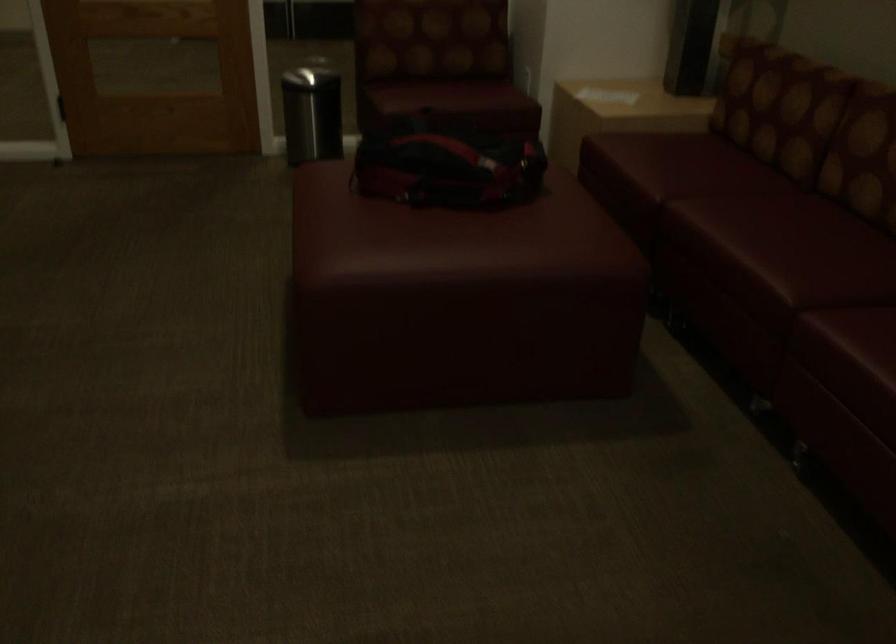
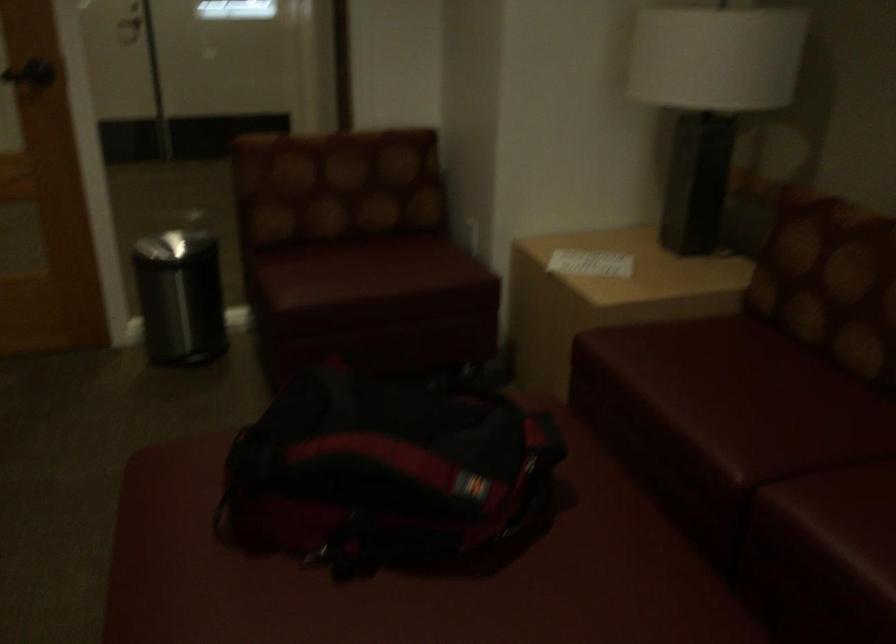
The point at (x=703, y=212) is marked in the first image. Where is the corresponding point in the second image?

(834, 522)